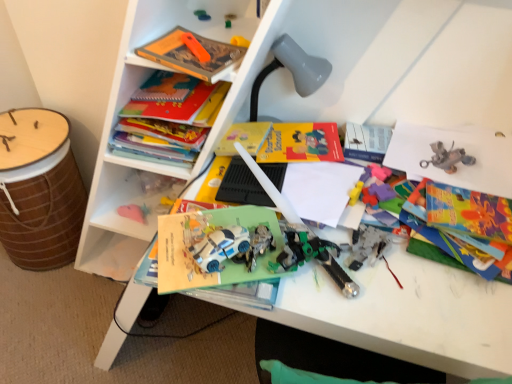
I want to click on vacant area situated to the left side of orange plastic toy at upper center, placed as the 3th toy when sorted from right to left, so click(165, 49).